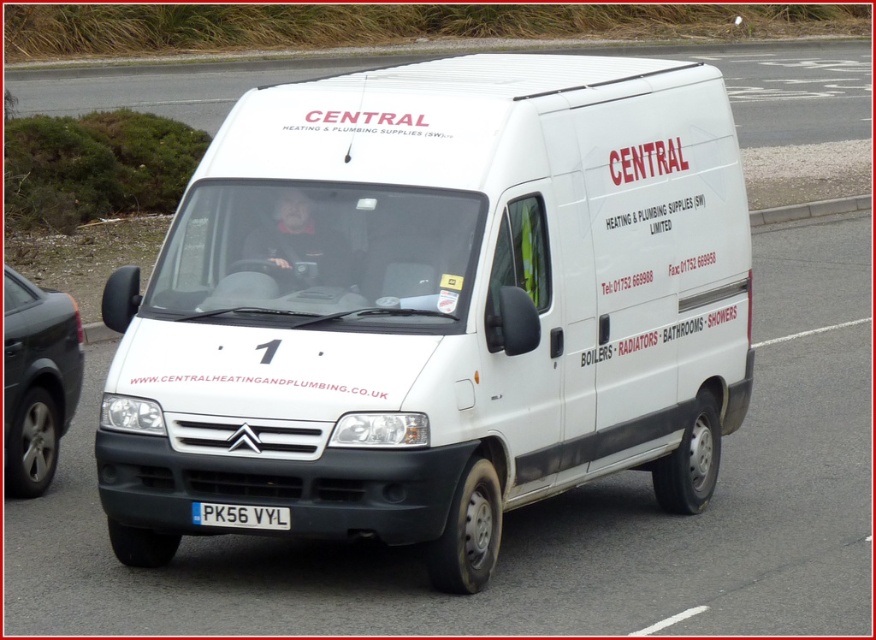
You are standing at the origin point of a coordinate system where the van is located at the coordinates given. If you want to move directly towards the silver metallic van at left, in which direction should you walk?

Since the silver metallic van at left is located at coordinates point (37, 380), you should walk in the direction of increasing x and y coordinates to reach it.

You are a pedestrian standing on the road and see both the white matte van at center and the silver metallic van at left. Which van is closer to the right side of the road?

The white matte van at center is closer to the right side of the road because it is positioned to the right of the silver metallic van at left.